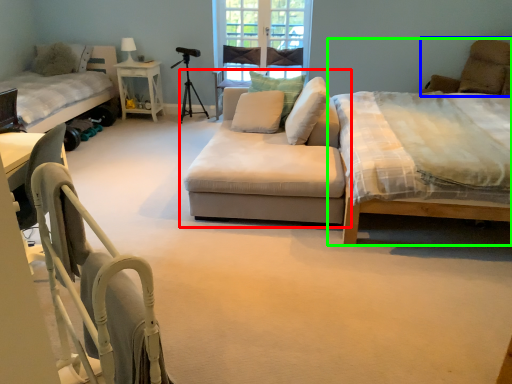
Question: Based on their relative distances, which object is nearer to studio couch (highlighted by a red box)? Choose from couch (highlighted by a blue box) and bed (highlighted by a green box).

Choices:
 (A) couch
 (B) bed

Answer: (A)